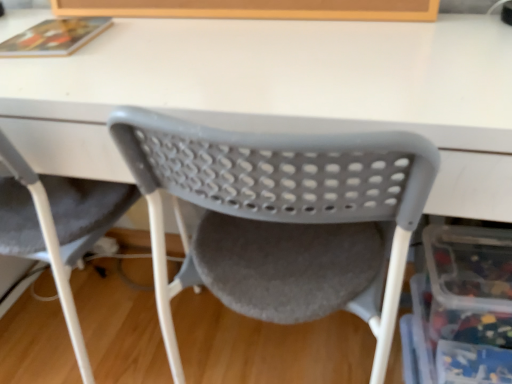
Question: In which direction should I rotate to look at matte plastic chair at center, the first chair positioned from the right?

Choices:
 (A) left
 (B) right

Answer: (B)

Question: From a real-world perspective, is matte plastic chair at center, the first chair positioned from the right, below gray plastic chair at lower left, acting as the first chair starting from the left?

Choices:
 (A) yes
 (B) no

Answer: (B)

Question: Can gray plastic chair at lower left, acting as the first chair starting from the left, be found inside matte plastic chair at center, the first chair positioned from the right?

Choices:
 (A) yes
 (B) no

Answer: (B)

Question: Would you consider matte plastic chair at center, the 2th chair positioned from the left, to be distant from gray plastic chair at lower left, marked as the second chair in a right-to-left arrangement?

Choices:
 (A) yes
 (B) no

Answer: (B)

Question: Is matte plastic chair at center, the 2th chair positioned from the left, positioned in front of gray plastic chair at lower left, marked as the second chair in a right-to-left arrangement?

Choices:
 (A) no
 (B) yes

Answer: (B)

Question: Does matte plastic chair at center, the first chair positioned from the right, have a greater height compared to gray plastic chair at lower left, marked as the second chair in a right-to-left arrangement?

Choices:
 (A) no
 (B) yes

Answer: (B)

Question: Is matte plastic chair at center, the 2th chair positioned from the left, completely or partially outside of gray plastic chair at lower left, acting as the first chair starting from the left?

Choices:
 (A) no
 (B) yes

Answer: (B)

Question: Is gray plastic chair at lower left, acting as the first chair starting from the left, further to the viewer compared to matte plastic chair at center, the 2th chair positioned from the left?

Choices:
 (A) no
 (B) yes

Answer: (B)

Question: From a real-world perspective, does gray plastic chair at lower left, marked as the second chair in a right-to-left arrangement, sit lower than matte plastic chair at center, the first chair positioned from the right?

Choices:
 (A) no
 (B) yes

Answer: (B)

Question: Considering the relative sizes of gray plastic chair at lower left, acting as the first chair starting from the left, and matte plastic chair at center, the first chair positioned from the right, in the image provided, is gray plastic chair at lower left, acting as the first chair starting from the left, taller than matte plastic chair at center, the first chair positioned from the right,?

Choices:
 (A) yes
 (B) no

Answer: (B)

Question: Does gray plastic chair at lower left, marked as the second chair in a right-to-left arrangement, have a larger size compared to matte plastic chair at center, the first chair positioned from the right?

Choices:
 (A) no
 (B) yes

Answer: (A)

Question: From the image's perspective, is gray plastic chair at lower left, acting as the first chair starting from the left, above matte plastic chair at center, the first chair positioned from the right?

Choices:
 (A) yes
 (B) no

Answer: (A)

Question: Does gray plastic chair at lower left, acting as the first chair starting from the left, have a smaller size compared to matte plastic chair at center, the first chair positioned from the right?

Choices:
 (A) no
 (B) yes

Answer: (B)

Question: Is matte plastic chair at center, the 2th chair positioned from the left, thinner than translucent plastic storage box at lower right?

Choices:
 (A) yes
 (B) no

Answer: (B)